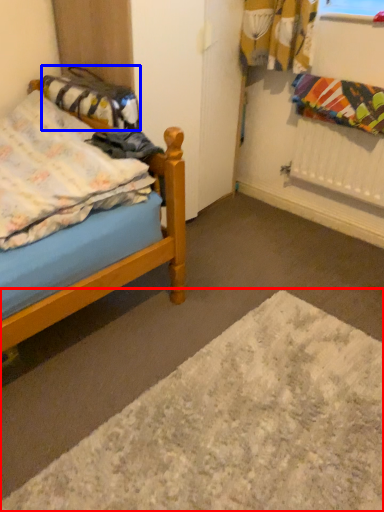
Question: Which point is further to the camera, plain (highlighted by a red box) or material (highlighted by a blue box)?

Choices:
 (A) plain
 (B) material

Answer: (B)